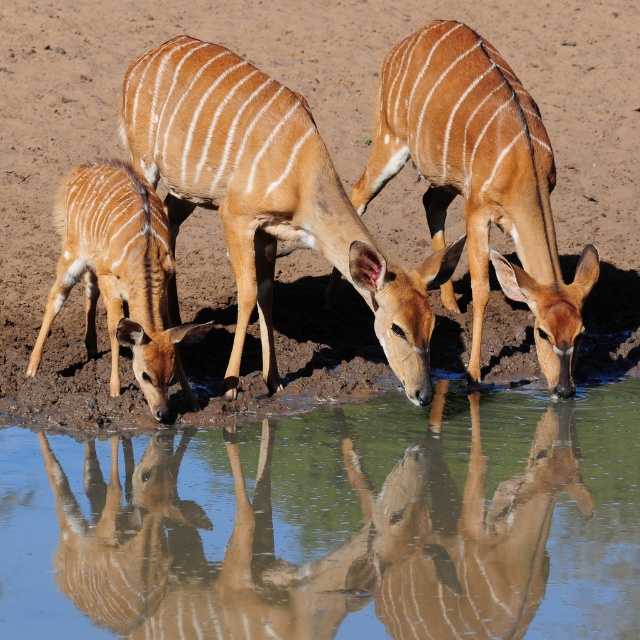
Does clear water at center appear on the right side of brown glossy antelope at center?

Incorrect, clear water at center is not on the right side of brown glossy antelope at center.

Between clear water at center and brown glossy antelope at center, which one appears on the left side from the viewer's perspective?

Positioned to the left is clear water at center.

This screenshot has width=640, height=640. What do you see at coordinates (332, 524) in the screenshot?
I see `clear water at center` at bounding box center [332, 524].

The width and height of the screenshot is (640, 640). Identify the location of clear water at center. point(332,524).

Looking at this image, can you confirm if clear water at center is positioned to the left of brown striped antelope at center?

In fact, clear water at center is to the right of brown striped antelope at center.

Find the location of a particular element. clear water at center is located at coordinates (332, 524).

What do you see at coordinates (332, 524) in the screenshot? The height and width of the screenshot is (640, 640). I see `clear water at center` at bounding box center [332, 524].

Where is `clear water at center`? clear water at center is located at coordinates (332, 524).

Is point (232, 204) less distant than point (157, 230)?

No, (232, 204) is further to viewer.

Can you confirm if brown striped antelope at center is smaller than light brown fur at lower left?

Incorrect, brown striped antelope at center is not smaller in size than light brown fur at lower left.

At what (x,y) coordinates should I click in order to perform the action: click on brown striped antelope at center. Please return your answer as a coordinate pair (x, y). Image resolution: width=640 pixels, height=640 pixels. Looking at the image, I should click on (268, 195).